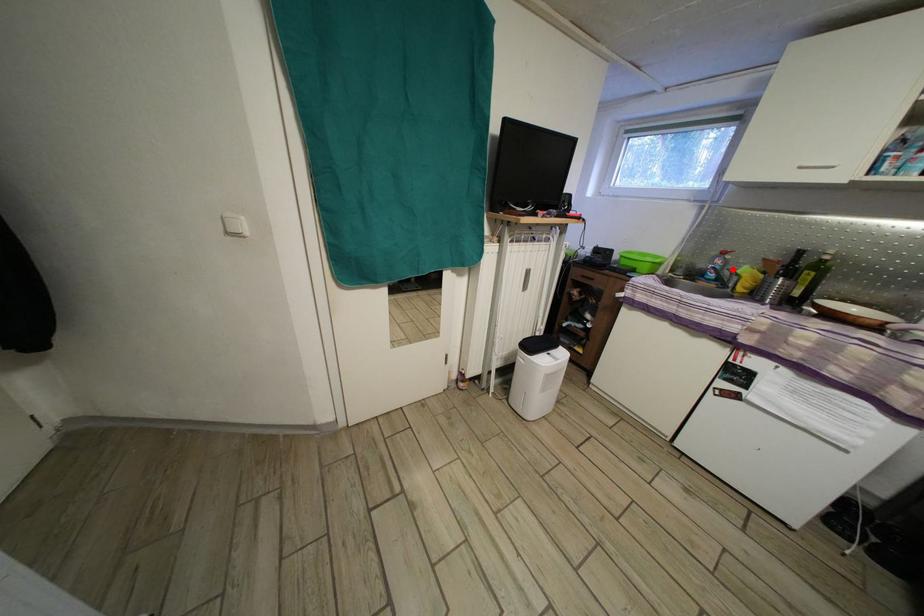
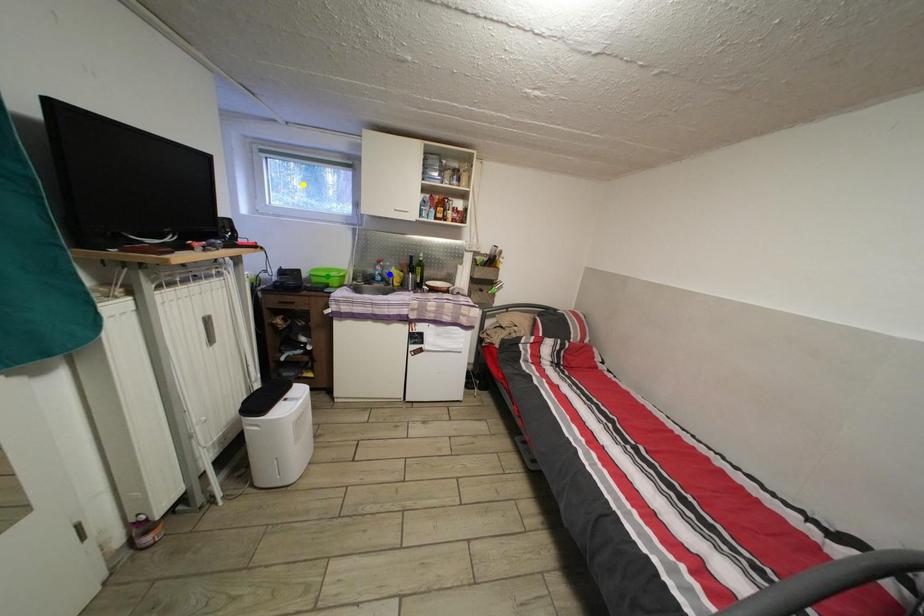
Question: I am providing you with two images of the same scene from different viewpoints. A red point is marked on the first image. You are given multiple points on the second image. Which point in image 2 represents the same 3d spot as the red point in image 1?

Choices:
 (A) green point
 (B) blue point
 (C) yellow point

Answer: (B)